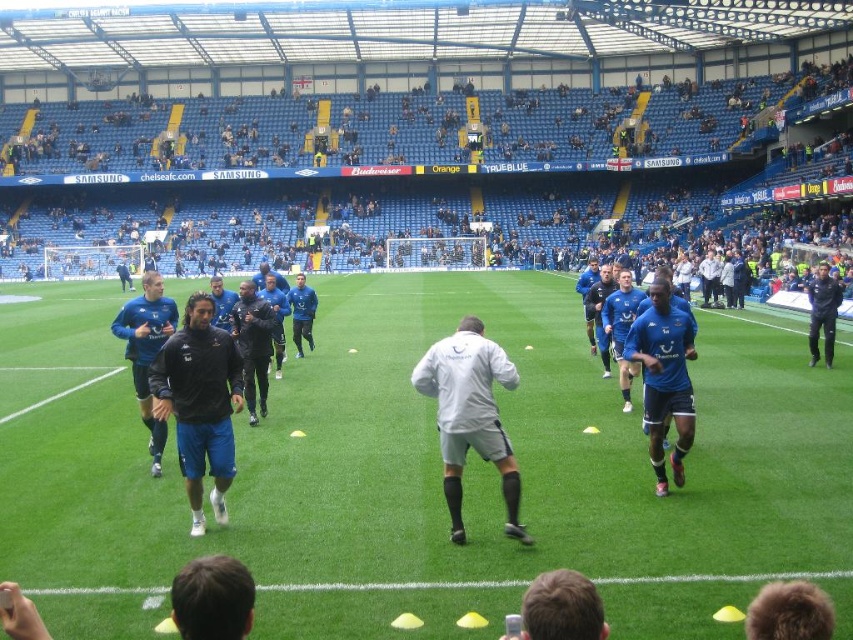
Which is more to the left, green grass field at center or dark blue jersey at center?

green grass field at center

Which is behind, point (235, 524) or point (822, 300)?

The point (822, 300) is more distant.

Between point (798, 484) and point (813, 323), which one is positioned behind?

Positioned behind is point (813, 323).

The height and width of the screenshot is (640, 853). What are the coordinates of `green grass field at center` in the screenshot? It's located at (422, 474).

Is point (598, 576) less distant than point (480, 349)?

That is True.

Does green grass field at center have a smaller size compared to white matte jacket at center?

Incorrect, green grass field at center is not smaller in size than white matte jacket at center.

From the picture: Who is more distant from viewer, (62, 456) or (445, 353)?

Point (62, 456)

Identify the location of green grass field at center. The image size is (853, 640). coord(422,474).

Is white matte jacket at center smaller than blue jersey at center?

Indeed, white matte jacket at center has a smaller size compared to blue jersey at center.

Is white matte jacket at center behind blue jersey at center?

No, it is not.

Is point (473, 353) positioned before point (128, 323)?

Yes, it is.

Locate an element on the screen. The width and height of the screenshot is (853, 640). white matte jacket at center is located at coordinates (469, 416).